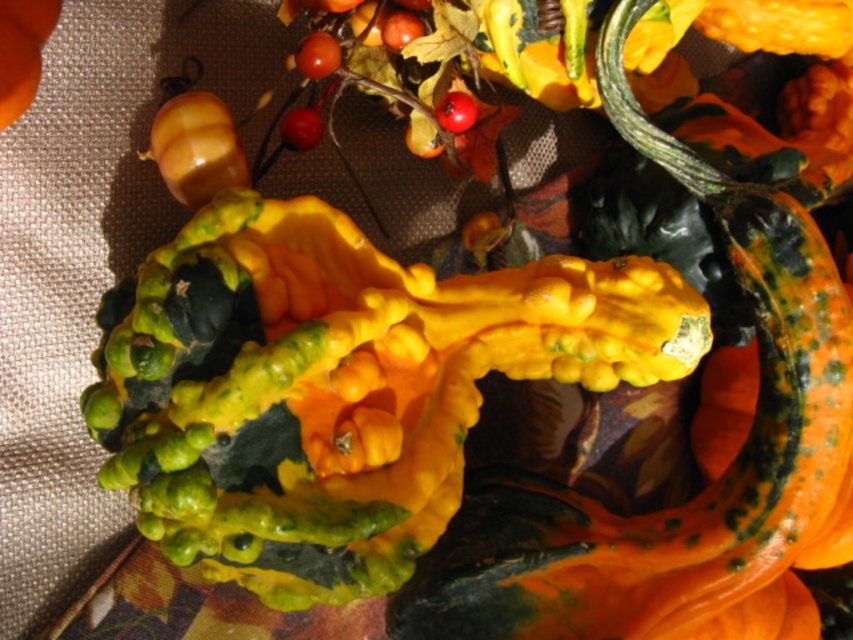
You are an artist trying to sketch the arrangement. You notice two points in the image at coordinates point (310, 70) and point (303, 125). Which point is closer to you when observing the decorative arrangement?

Point (310, 70) is in front of point (303, 125), so it is closer to you.